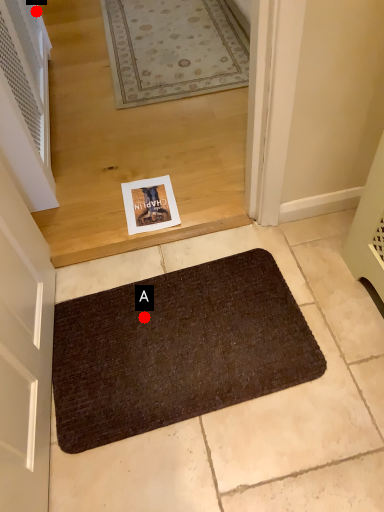
Question: Two points are circled on the image, labeled by A and B beside each circle. Which point is farther from the camera taking this photo?

Choices:
 (A) A is further
 (B) B is further

Answer: (B)